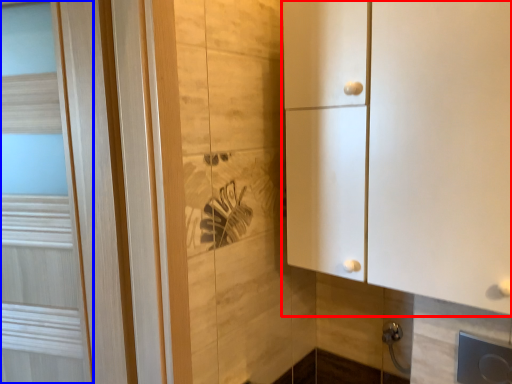
Question: Which object is closer to the camera taking this photo, cupboard (highlighted by a red box) or door (highlighted by a blue box)?

Choices:
 (A) cupboard
 (B) door

Answer: (A)